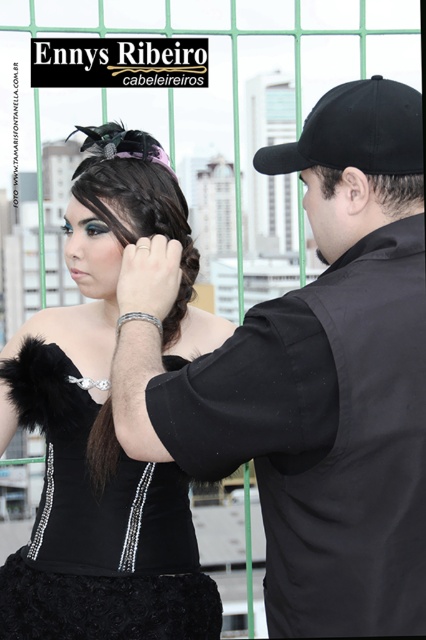
Question: Which point is closer to the camera taking this photo?

Choices:
 (A) (356, 116)
 (B) (383, 618)
 (C) (423, 193)

Answer: (B)

Question: Is black matte vest at center further to the viewer compared to dark brown hair at center?

Choices:
 (A) no
 (B) yes

Answer: (A)

Question: Can you confirm if satin dark brown hair at center is positioned above black matte baseball cap at upper right?

Choices:
 (A) yes
 (B) no

Answer: (B)

Question: Among these points, which one is nearest to the camera?

Choices:
 (A) (302, 612)
 (B) (406, 196)

Answer: (A)

Question: Which object is closer to the camera taking this photo?

Choices:
 (A) black matte vest at center
 (B) dark brown hair at center

Answer: (A)

Question: Does velvet black dress at center appear on the left side of satin dark brown hair at center?

Choices:
 (A) yes
 (B) no

Answer: (A)